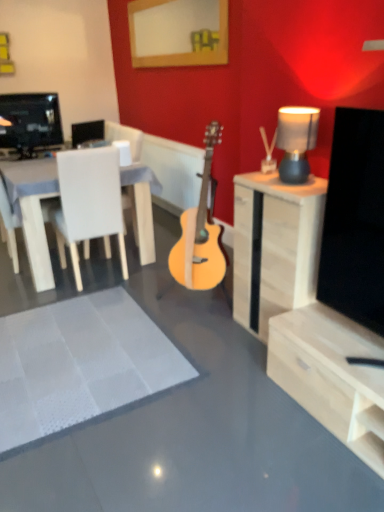
What do you see at coordinates (201, 232) in the screenshot? This screenshot has width=384, height=512. I see `light wood acoustic guitar at center` at bounding box center [201, 232].

What is the approximate height of white textured rug at center?

white textured rug at center is 1.27 inches tall.

Identify the location of white textured rug at center. (80, 362).

Describe the element at coordinates (89, 204) in the screenshot. The image size is (384, 512). I see `white matte chair at left` at that location.

What is the approximate height of white matte chair at left?

white matte chair at left is 37.55 inches tall.

What do you see at coordinates (296, 141) in the screenshot? The height and width of the screenshot is (512, 384). I see `matte gray lampshade at upper right` at bounding box center [296, 141].

The height and width of the screenshot is (512, 384). What are the coordinates of `wooden picture frame at upper center` in the screenshot? It's located at (178, 32).

Is point (76, 377) more distant than point (211, 226)?

No, it is in front of (211, 226).

Considering the relative sizes of white textured rug at center and light wood acoustic guitar at center in the image provided, is white textured rug at center smaller than light wood acoustic guitar at center?

Indeed, white textured rug at center has a smaller size compared to light wood acoustic guitar at center.

Is white textured rug at center closer to the viewer compared to light wood acoustic guitar at center?

Yes, white textured rug at center is closer to the camera.

Considering the sizes of objects white textured rug at center and light wood acoustic guitar at center in the image provided, who is shorter, white textured rug at center or light wood acoustic guitar at center?

white textured rug at center is shorter.

Is white textured rug at center positioned with its back to wooden picture frame at upper center?

No.

Between white textured rug at center and wooden picture frame at upper center, which one is positioned behind?

wooden picture frame at upper center is behind.

From the image's perspective, would you say white textured rug at center is positioned over wooden picture frame at upper center?

No, from the image's perspective, white textured rug at center is not above wooden picture frame at upper center.

Can wooden picture frame at upper center be found inside white textured rug at center?

No.

What's the angular difference between wooden picture frame at upper center and matte gray lampshade at upper right's facing directions?

There is a 3.47-degree angle between the facing directions of wooden picture frame at upper center and matte gray lampshade at upper right.

Which object is wider, wooden picture frame at upper center or matte gray lampshade at upper right?

With larger width is matte gray lampshade at upper right.

Which is behind, point (223, 62) or point (299, 119)?

Point (223, 62)

Does wooden picture frame at upper center lie in front of matte gray lampshade at upper right?

No.

Is matte gray lampshade at upper right turned away from light wood cabinet at right?

No, light wood cabinet at right is not at the back of matte gray lampshade at upper right.

Is light wood cabinet at right surrounded by matte gray lampshade at upper right?

No, light wood cabinet at right is not a part of matte gray lampshade at upper right.

From a real-world perspective, is matte gray lampshade at upper right located higher than light wood cabinet at right?

Yes, from a real-world perspective, matte gray lampshade at upper right is above light wood cabinet at right.

In the scene shown: Would you say matte gray lampshade at upper right is a long distance from wooden picture frame at upper center?

Yes, matte gray lampshade at upper right and wooden picture frame at upper center are located far from each other.

How much distance is there between matte gray lampshade at upper right and wooden picture frame at upper center?

The distance of matte gray lampshade at upper right from wooden picture frame at upper center is 1.87 meters.

From a real-world perspective, is matte gray lampshade at upper right beneath wooden picture frame at upper center?

Indeed, from a real-world perspective, matte gray lampshade at upper right is positioned beneath wooden picture frame at upper center.

How many degrees apart are the facing directions of matte gray lampshade at upper right and wooden picture frame at upper center?

There is a 3.47-degree angle between the facing directions of matte gray lampshade at upper right and wooden picture frame at upper center.

How different are the orientations of light wood acoustic guitar at center and wooden picture frame at upper center in degrees?

The angle between the facing direction of light wood acoustic guitar at center and the facing direction of wooden picture frame at upper center is 0.793 degrees.

Is light wood acoustic guitar at center located outside wooden picture frame at upper center?

Indeed, light wood acoustic guitar at center is completely outside wooden picture frame at upper center.

How distant is light wood acoustic guitar at center from wooden picture frame at upper center?

A distance of 1.80 meters exists between light wood acoustic guitar at center and wooden picture frame at upper center.

Is point (212, 135) closer to camera compared to point (153, 47)?

Yes, it is in front of point (153, 47).

Is light wood cabinet at right inside the boundaries of wooden picture frame at upper center, or outside?

light wood cabinet at right is not inside wooden picture frame at upper center, it's outside.

Which object is further away from the camera, light wood cabinet at right or wooden picture frame at upper center?

wooden picture frame at upper center is behind.

Between light wood cabinet at right and wooden picture frame at upper center, which one appears on the right side from the viewer's perspective?

light wood cabinet at right is more to the right.

Are light wood cabinet at right and wooden picture frame at upper center far apart?

Yes, light wood cabinet at right and wooden picture frame at upper center are quite far apart.

You are a GUI agent. You are given a task and a screenshot of the screen. Output one action in this format:
    pyautogui.click(x=<x>, y=<y>)
    Task: Click on the flat that appears on the left of light wood acoustic guitar at center
    The image size is (384, 512).
    Given the screenshot: What is the action you would take?
    pyautogui.click(x=80, y=362)

The width and height of the screenshot is (384, 512). I want to click on flat lying below the wooden picture frame at upper center (from the image's perspective), so tap(80, 362).

Looking at the image, which one is located closer to white matte chair at left, light wood cabinet at right or white textured rug at center?

white textured rug at center lies closer to white matte chair at left than the other object.

Which object lies further to the anchor point light wood acoustic guitar at center, matte gray lampshade at upper right or white matte chair at left?

The object further to light wood acoustic guitar at center is matte gray lampshade at upper right.

When comparing their distances from white textured rug at center, does matte gray lampshade at upper right or wooden picture frame at upper center seem closer?

matte gray lampshade at upper right.

Estimate the real-world distances between objects in this image. Which object is further from light wood cabinet at right, white matte chair at left or light wood acoustic guitar at center?

white matte chair at left is further to light wood cabinet at right.

Based on their spatial positions, is wooden picture frame at upper center or light wood cabinet at right closer to white matte chair at left?

light wood cabinet at right.

Which object lies nearer to the anchor point wooden picture frame at upper center, white textured rug at center or light wood cabinet at right?

light wood cabinet at right.

From the image, which object appears to be farther from white matte chair at left, wooden picture frame at upper center or light wood acoustic guitar at center?

The object further to white matte chair at left is wooden picture frame at upper center.

Based on their spatial positions, is wooden picture frame at upper center or matte gray lampshade at upper right closer to light wood cabinet at right?

matte gray lampshade at upper right is closer to light wood cabinet at right.

I want to click on guitar that lies between wooden picture frame at upper center and white textured rug at center from top to bottom, so click(x=201, y=232).

Identify the location of chair between wooden picture frame at upper center and white textured rug at center in the up-down direction. (89, 204).

Find the location of a particular element. Image resolution: width=384 pixels, height=512 pixels. guitar situated between white matte chair at left and light wood cabinet at right from left to right is located at coordinates (201, 232).

Where is `guitar between white matte chair at left and matte gray lampshade at upper right from left to right`? The image size is (384, 512). guitar between white matte chair at left and matte gray lampshade at upper right from left to right is located at coordinates (201, 232).